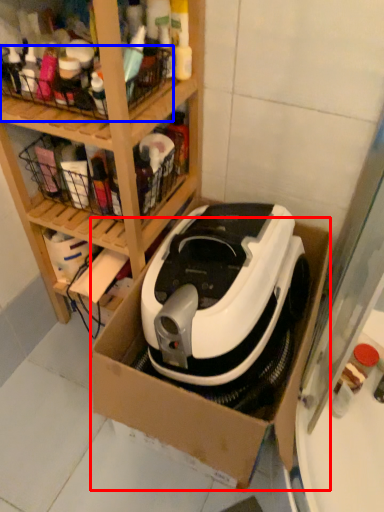
Question: Which object is further to the camera taking this photo, cardboard box (highlighted by a red box) or basket (highlighted by a blue box)?

Choices:
 (A) cardboard box
 (B) basket

Answer: (B)